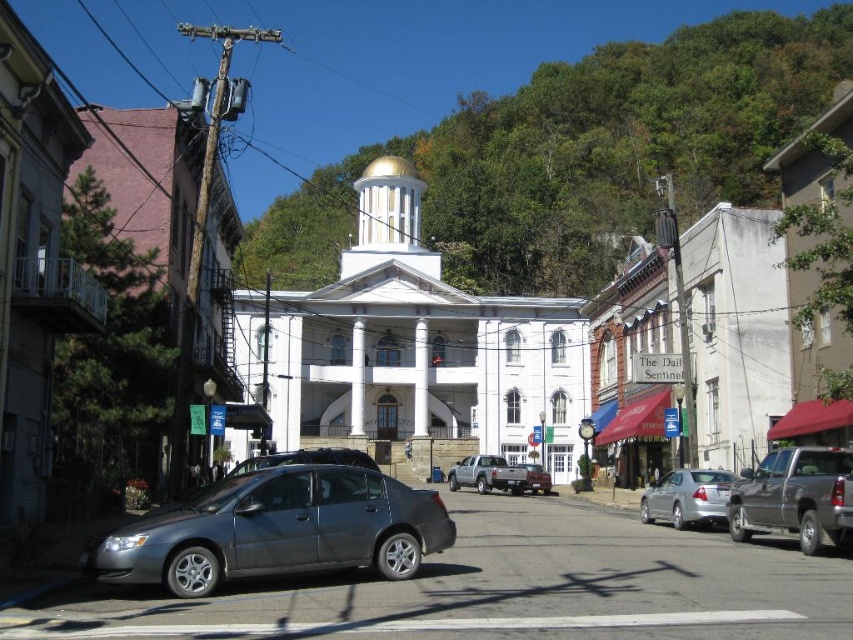
Question: From the image, what is the correct spatial relationship of silver metallic sedan at center in relation to silver metallic truck at center?

Choices:
 (A) above
 (B) below

Answer: (A)

Question: Which point is closer to the camera taking this photo?

Choices:
 (A) (473, 477)
 (B) (730, 524)

Answer: (B)

Question: Does white glossy church at center appear under satin gray sedan at lower left?

Choices:
 (A) yes
 (B) no

Answer: (B)

Question: Which object appears closest to the camera in this image?

Choices:
 (A) matte red truck at center
 (B) white glossy church at center
 (C) satin gray sedan at lower left

Answer: (C)

Question: Which object is the farthest from the metallic gray truck at center right?

Choices:
 (A) white glossy church at center
 (B) silver metallic truck at center
 (C) matte red truck at center

Answer: (A)

Question: Can you confirm if white glossy church at center is wider than silver metallic sedan at center?

Choices:
 (A) yes
 (B) no

Answer: (A)